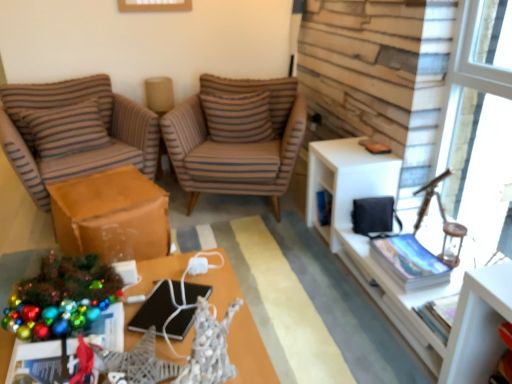
Identify the location of space that is in front of brown striped fabric chair at center, arranged as the first chair when viewed from the right. The width and height of the screenshot is (512, 384). (255, 251).